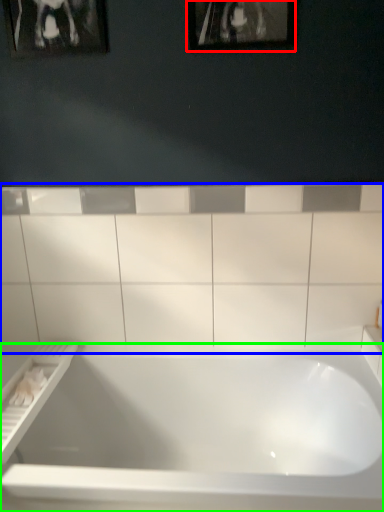
Question: Considering the real-world distances, which object is closest to picture frame (highlighted by a red box)? ceramic tile (highlighted by a blue box) or bathtub (highlighted by a green box).

Choices:
 (A) ceramic tile
 (B) bathtub

Answer: (A)